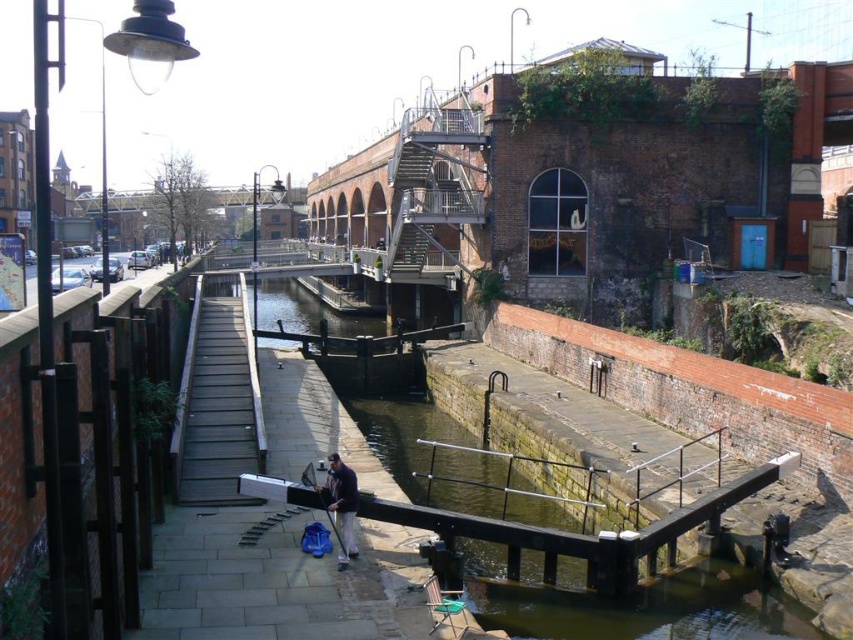
Question: Does wooden planks dock at center appear on the left side of dark blue fabric at center?

Choices:
 (A) yes
 (B) no

Answer: (A)

Question: Among these points, which one is nearest to the camera?

Choices:
 (A) [x=222, y=465]
 (B) [x=326, y=476]

Answer: (B)

Question: Is wooden planks dock at center further to camera compared to dark blue fabric at center?

Choices:
 (A) no
 (B) yes

Answer: (B)

Question: Is wooden planks dock at center above dark blue fabric at center?

Choices:
 (A) yes
 (B) no

Answer: (A)

Question: Which object is closer to the camera taking this photo?

Choices:
 (A) wooden planks dock at center
 (B) dark blue fabric at center

Answer: (B)